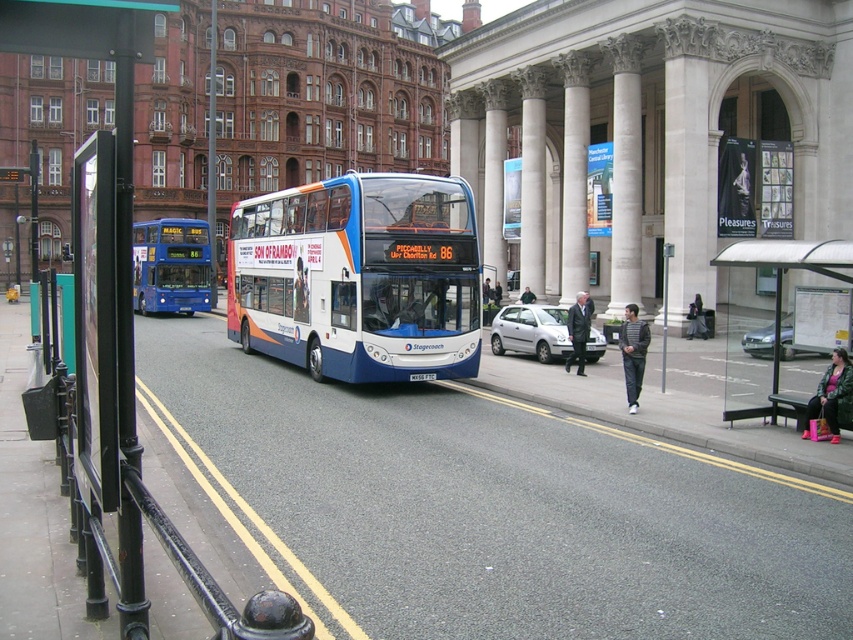
Question: Is matte pink jacket at lower right closer to the viewer compared to black plastic license plate at center?

Choices:
 (A) yes
 (B) no

Answer: (A)

Question: Based on their relative distances, which object is farther from the transparent glass bus stop at right?

Choices:
 (A) blue matte bus at center
 (B) black plastic license plate at center
 (C) silver metallic hatchback at center

Answer: (A)

Question: Which is nearer to the silver metallic hatchback at center?

Choices:
 (A) silver metallic sedan at center
 (B) dark gray jacket at center
 (C) dark gray pants at center
 (D) transparent glass bus stop at right

Answer: (A)

Question: Does gray concrete curb at lower right have a smaller size compared to striped sweater at lower right?

Choices:
 (A) no
 (B) yes

Answer: (B)

Question: Does gray concrete curb at lower right lie in front of black plastic license plate at center?

Choices:
 (A) yes
 (B) no

Answer: (A)

Question: Which of the following is the closest to the observer?

Choices:
 (A) (564, 356)
 (B) (706, 333)

Answer: (A)